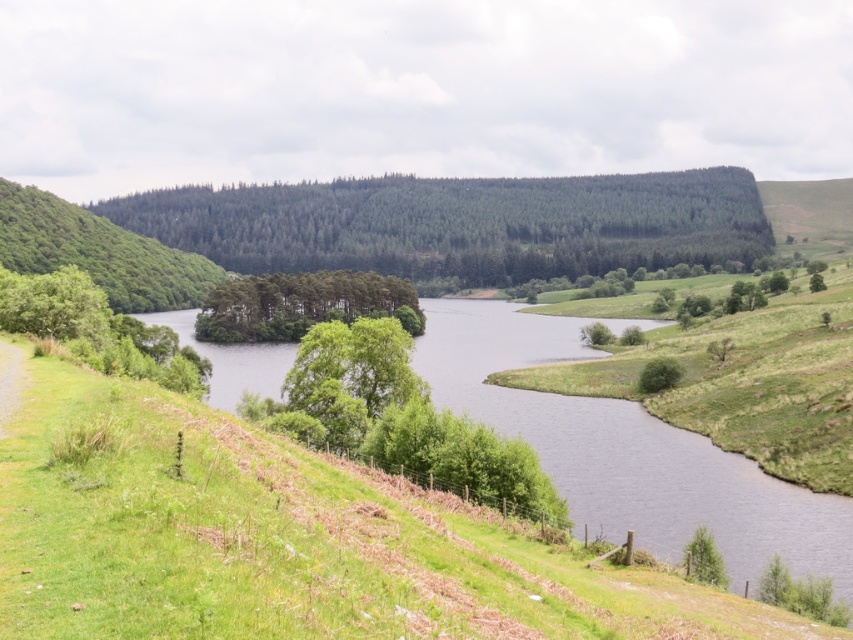
Question: Considering the real-world distances, which object is closest to the green textured forest at center?

Choices:
 (A) gravel path at lower left
 (B) green leafy tree at left
 (C) green leafy trees at center
 (D) green matte tree at lower right

Answer: (C)

Question: Is green grassy at lower left smaller than green leafy tree at left?

Choices:
 (A) no
 (B) yes

Answer: (B)

Question: Estimate the real-world distances between objects in this image. Which object is closer to the gravel path at lower left?

Choices:
 (A) green leafy tree at center-right
 (B) green leafy tree at left
 (C) green textured forest at center
 (D) green leafy trees at center

Answer: (B)

Question: Which object is the closest to the gravel path at lower left?

Choices:
 (A) green leafy tree at left
 (B) green leafy tree at center-right

Answer: (A)

Question: Observing the image, what is the correct spatial positioning of gravel path at lower left in reference to green matte tree at lower right?

Choices:
 (A) right
 (B) left

Answer: (B)

Question: Does green leafy trees at center appear on the right side of green matte tree at lower right?

Choices:
 (A) no
 (B) yes

Answer: (A)